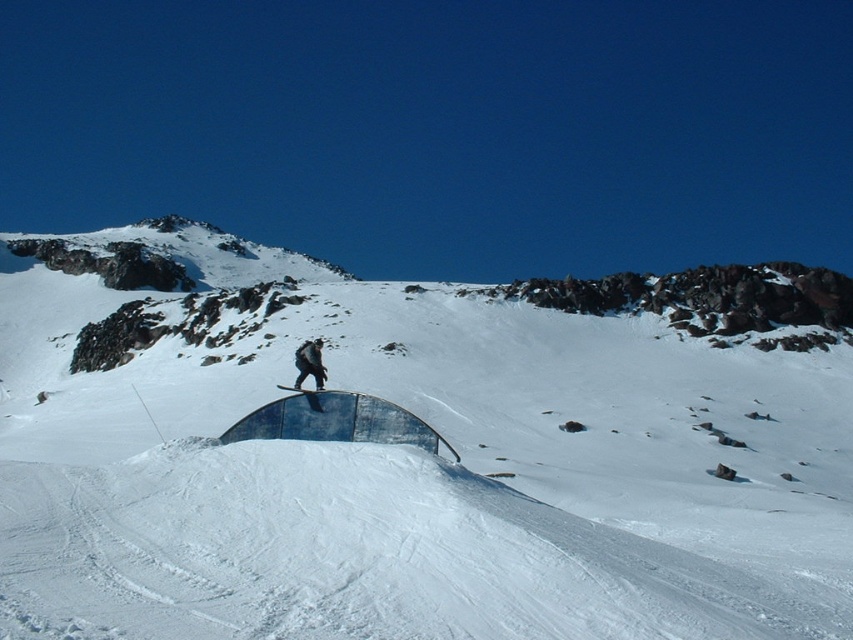
Question: Can you confirm if white matte snow at center is positioned to the right of black matte snowboarder at center?

Choices:
 (A) yes
 (B) no

Answer: (B)

Question: Does white matte snow at center appear on the right side of blue wooden snowboard at center?

Choices:
 (A) yes
 (B) no

Answer: (B)

Question: Which object is the closest to the blue wooden snowboard at center?

Choices:
 (A) black matte snowboard at center
 (B) black matte snowboarder at center
 (C) white matte snow at center

Answer: (A)

Question: Which object is closer to the camera taking this photo?

Choices:
 (A) blue wooden snowboard at center
 (B) black matte snowboarder at center
 (C) black matte snowboard at center
 (D) white matte snow at center

Answer: (D)

Question: Which object is farther from the camera taking this photo?

Choices:
 (A) black matte snowboarder at center
 (B) white matte snow at center
 (C) black matte snowboard at center
 (D) blue wooden snowboard at center

Answer: (A)

Question: Is black matte snowboarder at center to the right of black matte snowboard at center from the viewer's perspective?

Choices:
 (A) no
 (B) yes

Answer: (A)